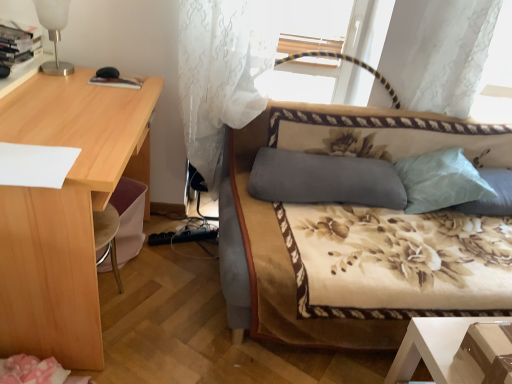
Question: Does white frosted glass table lamp at upper left touch floral-patterned fabric couch at center?

Choices:
 (A) yes
 (B) no

Answer: (B)

Question: Is white frosted glass table lamp at upper left located outside floral-patterned fabric couch at center?

Choices:
 (A) no
 (B) yes

Answer: (B)

Question: Is white frosted glass table lamp at upper left at the left side of floral-patterned fabric couch at center?

Choices:
 (A) no
 (B) yes

Answer: (B)

Question: Does white frosted glass table lamp at upper left have a larger size compared to floral-patterned fabric couch at center?

Choices:
 (A) no
 (B) yes

Answer: (A)

Question: Considering the relative sizes of white frosted glass table lamp at upper left and floral-patterned fabric couch at center in the image provided, is white frosted glass table lamp at upper left smaller than floral-patterned fabric couch at center?

Choices:
 (A) yes
 (B) no

Answer: (A)

Question: Is point (48, 64) positioned closer to the camera than point (433, 180)?

Choices:
 (A) closer
 (B) farther

Answer: (A)

Question: From the image's perspective, relative to light blue textured pillow at upper right, which ranks as the second pillow in right-to-left order, is white frosted glass table lamp at upper left above or below?

Choices:
 (A) above
 (B) below

Answer: (A)

Question: Is white frosted glass table lamp at upper left inside or outside of light blue textured pillow at upper right, the second pillow in the left-to-right sequence?

Choices:
 (A) outside
 (B) inside

Answer: (A)

Question: In terms of size, does white frosted glass table lamp at upper left appear bigger or smaller than light blue textured pillow at upper right, which ranks as the second pillow in right-to-left order?

Choices:
 (A) small
 (B) big

Answer: (A)

Question: Considering the relative positions of light blue textured pillow at upper right, which ranks as the second pillow in right-to-left order, and white sheer curtain at center in the image provided, is light blue textured pillow at upper right, which ranks as the second pillow in right-to-left order, to the left or to the right of white sheer curtain at center?

Choices:
 (A) right
 (B) left

Answer: (A)

Question: Considering the positions of point (443, 167) and point (231, 84), is point (443, 167) closer or farther from the camera than point (231, 84)?

Choices:
 (A) closer
 (B) farther

Answer: (B)

Question: Considering the positions of light blue textured pillow at upper right, the second pillow in the left-to-right sequence, and white sheer curtain at center in the image, is light blue textured pillow at upper right, the second pillow in the left-to-right sequence, taller or shorter than white sheer curtain at center?

Choices:
 (A) short
 (B) tall

Answer: (A)

Question: From the image's perspective, is light blue textured pillow at upper right, the second pillow in the left-to-right sequence, above or below white sheer curtain at center?

Choices:
 (A) below
 (B) above

Answer: (A)

Question: Is white frosted glass table lamp at upper left in front of or behind white sheer curtain at center in the image?

Choices:
 (A) behind
 (B) front

Answer: (A)

Question: From a real-world perspective, relative to white sheer curtain at center, is white frosted glass table lamp at upper left vertically above or below?

Choices:
 (A) below
 (B) above

Answer: (B)